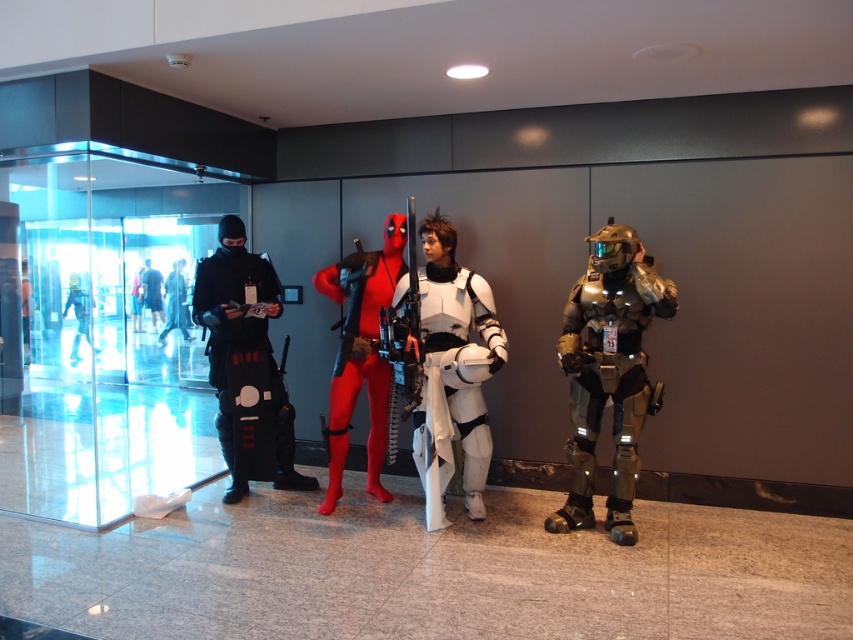
You are organizing a photo shoot and need to position the white matte armor at center and the black matte ninja at left in a row. Given their sizes, which object should be placed first to ensure they fit within a 2.5 meter long platform?

The white matte armor at center is wider than the black matte ninja at left. To fit both on a 2.5 meter platform, place the wider white matte armor at center first, followed by the narrower black matte ninja at left, ensuring their combined width does not exceed the platform length.